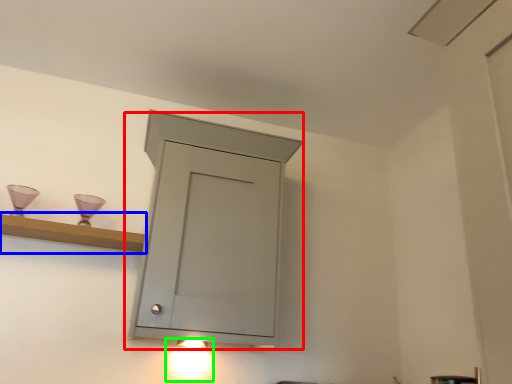
Question: Which is farther away from cupboard (highlighted by a red box)? shelf (highlighted by a blue box) or light fixture (highlighted by a green box)?

Choices:
 (A) shelf
 (B) light fixture

Answer: (B)